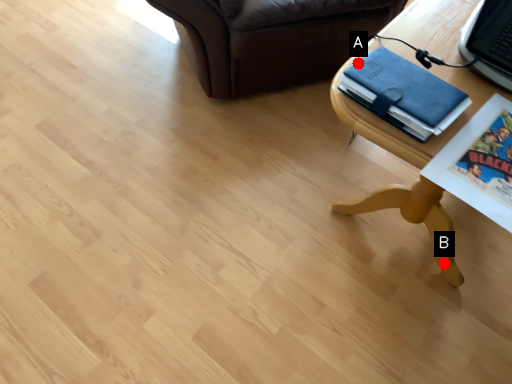
Question: Two points are circled on the image, labeled by A and B beside each circle. Among these points, which one is farthest from the camera?

Choices:
 (A) A is further
 (B) B is further

Answer: (B)